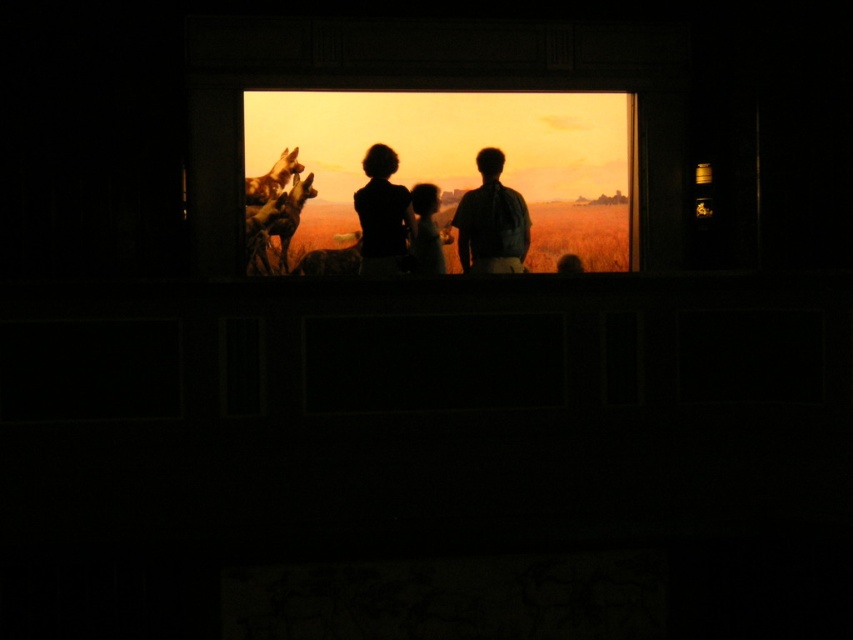
Question: Observing the image, what is the correct spatial positioning of matte glass window at center in reference to black matte shirt at center?

Choices:
 (A) right
 (B) left

Answer: (A)

Question: Estimate the real-world distances between objects in this image. Which object is closer to the dark green shirt at center?

Choices:
 (A) matte glass window at center
 (B) silhouette family at center
 (C) smooth skin child at center
 (D) black matte shirt at center

Answer: (B)

Question: Is dark green shirt at center thinner than smooth skin child at center?

Choices:
 (A) no
 (B) yes

Answer: (A)

Question: Among these objects, which one is farthest from the camera?

Choices:
 (A) matte glass window at center
 (B) black matte shirt at center

Answer: (A)

Question: Is black matte shirt at center wider than smooth skin child at center?

Choices:
 (A) no
 (B) yes

Answer: (B)

Question: Which point is closer to the camera taking this photo?

Choices:
 (A) (496, 193)
 (B) (490, 243)

Answer: (B)